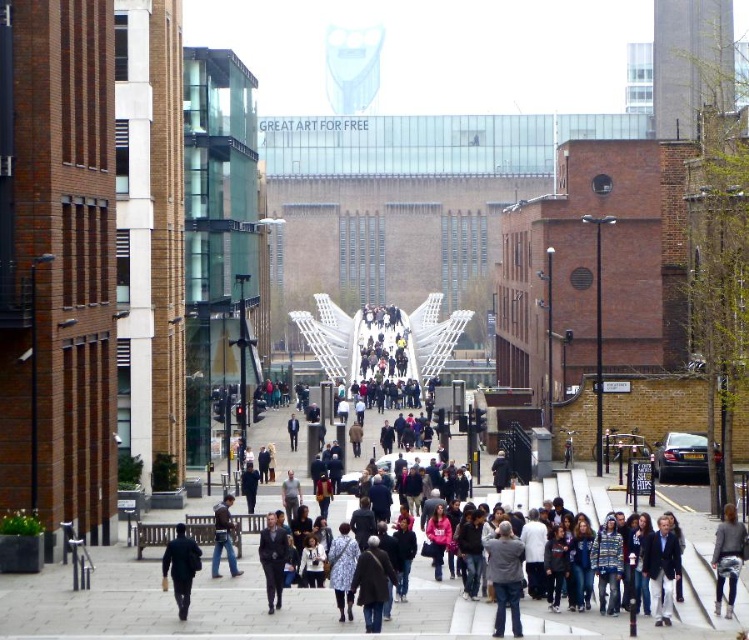
Which of these two, dark blue jacket at lower left or dark gray suit at center, stands shorter?

Standing shorter between the two is dark blue jacket at lower left.

Does dark blue jacket at lower left appear on the left side of dark gray suit at center?

Correct, you'll find dark blue jacket at lower left to the left of dark gray suit at center.

The width and height of the screenshot is (749, 640). Identify the location of dark blue jacket at lower left. (181, 566).

Which is below, denim jacket at lower right or dark gray suit at center?

dark gray suit at center is below.

Can you confirm if denim jacket at lower right is shorter than dark gray suit at center?

In fact, denim jacket at lower right may be taller than dark gray suit at center.

Find the location of a particular element. denim jacket at lower right is located at coordinates (727, 556).

Which is more to the left, denim jacket at lower right or dark blue suit at center?

From the viewer's perspective, dark blue suit at center appears more on the left side.

Between point (736, 570) and point (294, 417), which one is positioned behind?

The point (294, 417) is behind.

Is point (721, 529) closer to camera compared to point (297, 424)?

Yes.

This screenshot has width=749, height=640. What are the coordinates of `denim jacket at lower right` in the screenshot? It's located at (727, 556).